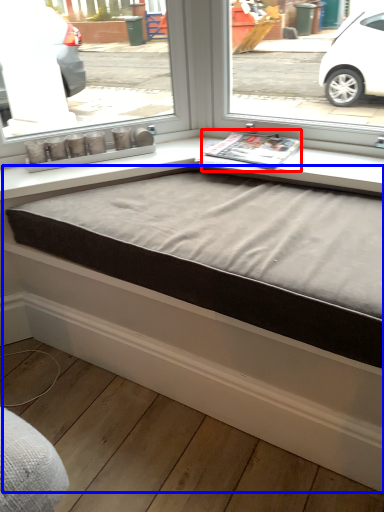
Question: Among these objects, which one is farthest to the camera, magazine (highlighted by a red box) or bed frame (highlighted by a blue box)?

Choices:
 (A) magazine
 (B) bed frame

Answer: (A)